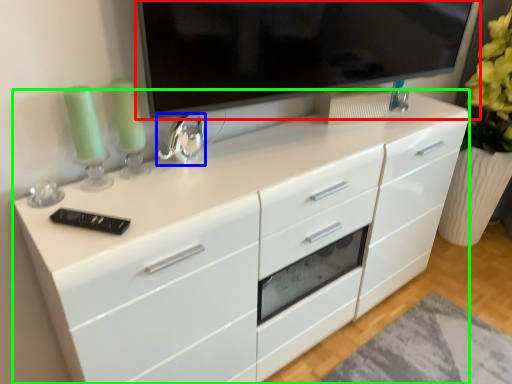
Question: Based on their relative distances, which object is farther from television (highlighted by a red box)? Choose from appliance (highlighted by a blue box) and chest of drawers (highlighted by a green box).

Choices:
 (A) appliance
 (B) chest of drawers

Answer: (B)